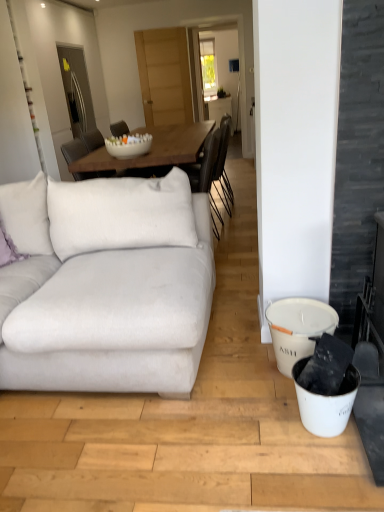
This screenshot has height=512, width=384. Find the location of `free location to the left of white matte bucket at lower right`. free location to the left of white matte bucket at lower right is located at coordinates (236, 373).